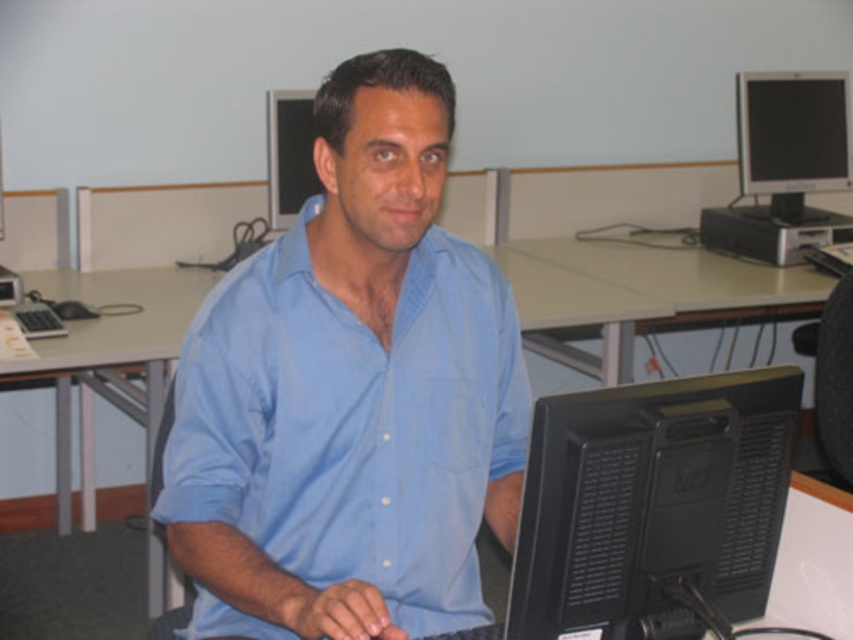
What do you see at coordinates (351, 392) in the screenshot?
I see `blue cotton shirt at center` at bounding box center [351, 392].

Does blue cotton shirt at center lie behind matte black monitor at upper center?

No, it is not.

Between point (209, 448) and point (276, 216), which one is positioned behind?

The point (276, 216) is behind.

The image size is (853, 640). What are the coordinates of `blue cotton shirt at center` in the screenshot? It's located at (351, 392).

Does point (354, 577) come in front of point (814, 355)?

Yes, it is.

How far apart are blue cotton shirt at center and black fabric swivel chair at right?

blue cotton shirt at center is 4.94 feet from black fabric swivel chair at right.

Where is `blue cotton shirt at center`? The width and height of the screenshot is (853, 640). blue cotton shirt at center is located at coordinates (351, 392).

Find the location of a particular element. This screenshot has height=640, width=853. blue cotton shirt at center is located at coordinates (351, 392).

What do you see at coordinates (351, 392) in the screenshot? The image size is (853, 640). I see `blue cotton shirt at center` at bounding box center [351, 392].

Can you confirm if blue cotton shirt at center is wider than black glossy monitor at upper right?

Yes, blue cotton shirt at center is wider than black glossy monitor at upper right.

Is point (215, 307) positioned after point (762, 113)?

No, it is not.

This screenshot has height=640, width=853. I want to click on blue cotton shirt at center, so click(351, 392).